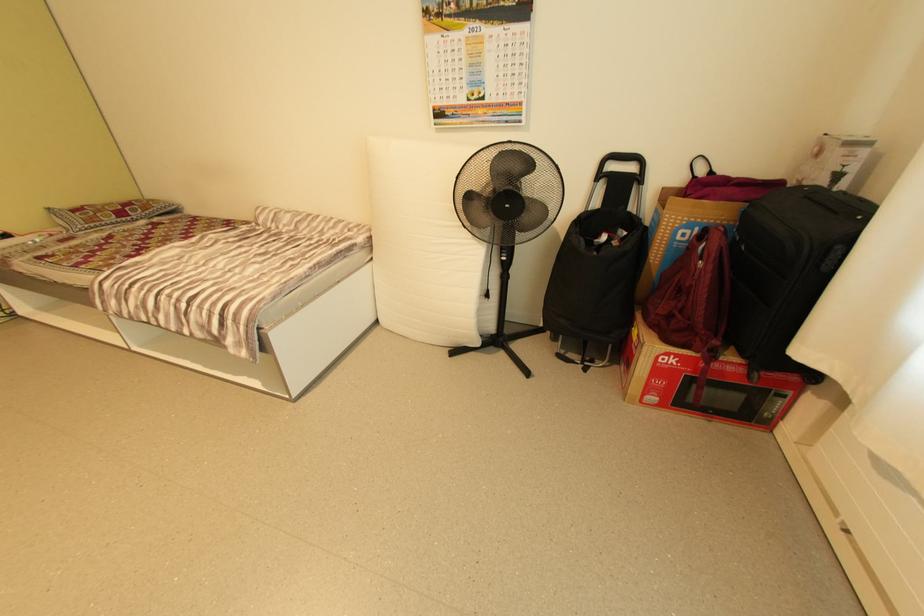
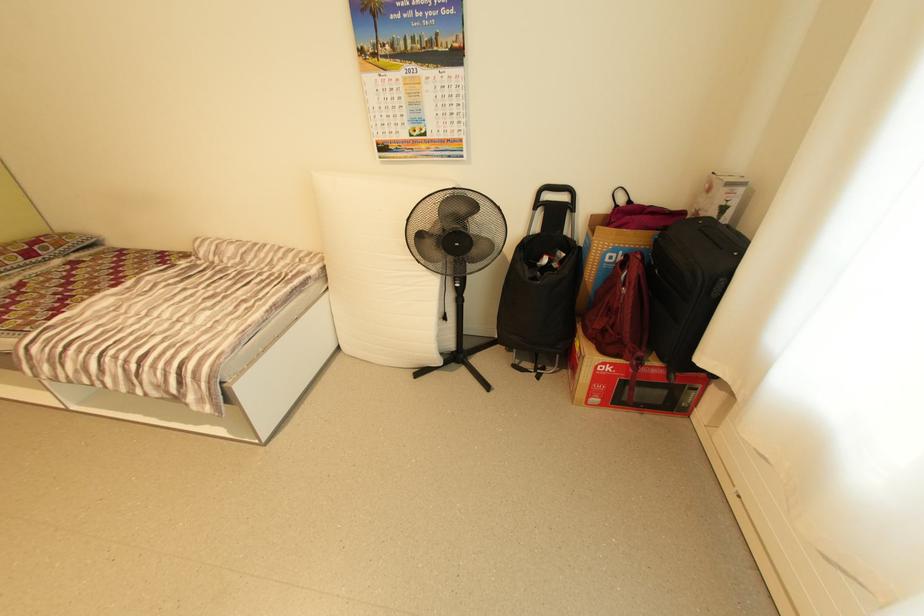
Find the pixel in the second image that matches (x=511, y=259) in the first image.

(464, 286)